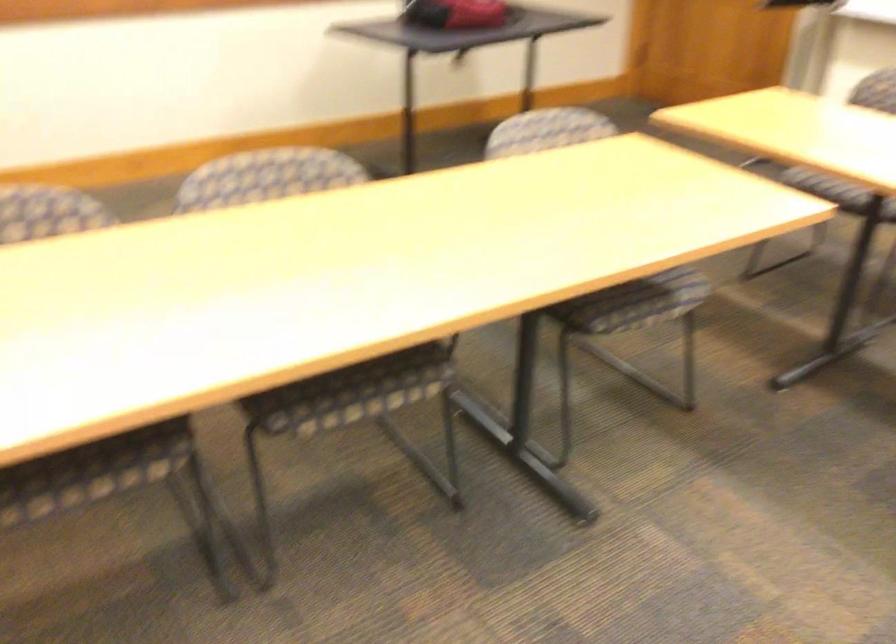
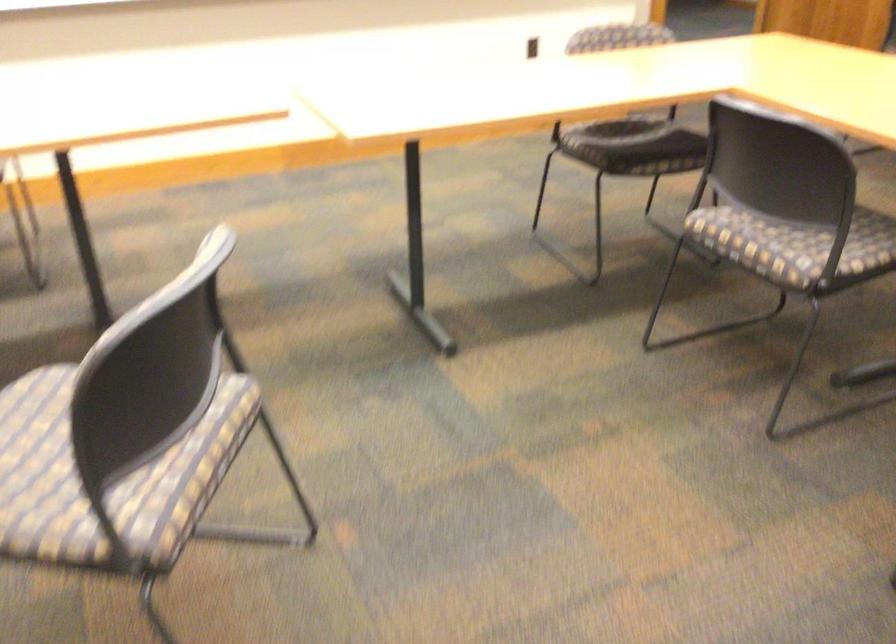
Based on the continuous images, in which direction is the camera rotating?

The camera's rotation is toward right-down.